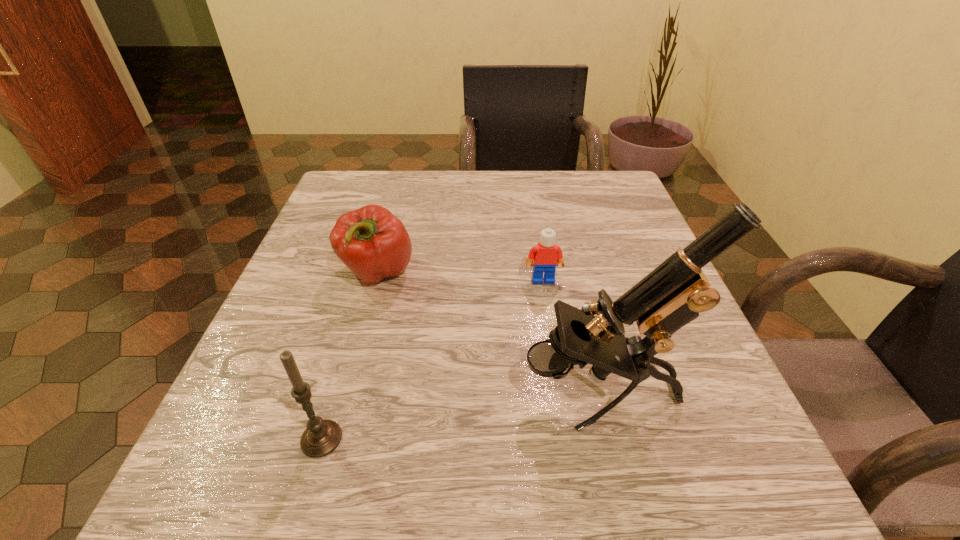
At what (x,y) coordinates should I click in order to perform the action: click on object that is positioned at the near edge. Please return your answer as a coordinate pair (x, y). Looking at the image, I should click on (321, 437).

Image resolution: width=960 pixels, height=540 pixels. I want to click on candle positioned at the left edge, so click(x=321, y=437).

You are a GUI agent. You are given a task and a screenshot of the screen. Output one action in this format:
    pyautogui.click(x=<x>, y=<y>)
    Task: Click on the bell pepper situated at the left edge
    
    Given the screenshot: What is the action you would take?
    pyautogui.click(x=374, y=244)

At what (x,y) coordinates should I click in order to perform the action: click on object that is at the right edge. Please return your answer as a coordinate pair (x, y). The height and width of the screenshot is (540, 960). Looking at the image, I should click on (672, 295).

Where is `object that is at the near left corner`? The width and height of the screenshot is (960, 540). object that is at the near left corner is located at coordinates (321, 437).

The image size is (960, 540). In the image, there is a desktop. In order to click on vacant area at the far edge in this screenshot , I will do `click(407, 192)`.

Locate an element on the screen. vacant space at the near edge of the desktop is located at coordinates (468, 477).

You are a GUI agent. You are given a task and a screenshot of the screen. Output one action in this format:
    pyautogui.click(x=<x>, y=<y>)
    Task: Click on the free space at the left edge of the desktop
    The image size is (960, 540).
    Given the screenshot: What is the action you would take?
    pyautogui.click(x=350, y=314)

You are a GUI agent. You are given a task and a screenshot of the screen. Output one action in this format:
    pyautogui.click(x=<x>, y=<y>)
    Task: Click on the vacant space at the right edge of the desktop
    The height and width of the screenshot is (540, 960).
    Given the screenshot: What is the action you would take?
    pyautogui.click(x=628, y=235)

Locate an element on the screen. vacant space at the far left corner of the desktop is located at coordinates (371, 179).